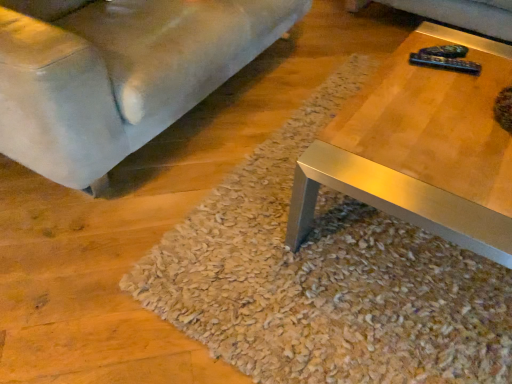
Question: Is shaggy beige carpet at center surrounded by suede-like gray couch at lower left?

Choices:
 (A) no
 (B) yes

Answer: (A)

Question: Is suede-like gray couch at lower left shorter than shaggy beige carpet at center?

Choices:
 (A) yes
 (B) no

Answer: (B)

Question: Considering the relative sizes of suede-like gray couch at lower left and shaggy beige carpet at center in the image provided, is suede-like gray couch at lower left bigger than shaggy beige carpet at center?

Choices:
 (A) no
 (B) yes

Answer: (B)

Question: Is the position of suede-like gray couch at lower left less distant than that of shaggy beige carpet at center?

Choices:
 (A) yes
 (B) no

Answer: (A)

Question: Is suede-like gray couch at lower left at the left side of shaggy beige carpet at center?

Choices:
 (A) no
 (B) yes

Answer: (B)

Question: Does suede-like gray couch at lower left appear on the right side of shaggy beige carpet at center?

Choices:
 (A) yes
 (B) no

Answer: (B)

Question: Considering the relative sizes of shaggy beige carpet at center and suede-like gray couch at lower left in the image provided, is shaggy beige carpet at center wider than suede-like gray couch at lower left?

Choices:
 (A) yes
 (B) no

Answer: (A)

Question: Is shaggy beige carpet at center beside suede-like gray couch at lower left?

Choices:
 (A) no
 (B) yes

Answer: (A)

Question: Considering the relative positions of shaggy beige carpet at center and suede-like gray couch at lower left in the image provided, is shaggy beige carpet at center behind suede-like gray couch at lower left?

Choices:
 (A) no
 (B) yes

Answer: (B)

Question: From a real-world perspective, is shaggy beige carpet at center under suede-like gray couch at lower left?

Choices:
 (A) yes
 (B) no

Answer: (A)

Question: Can you confirm if shaggy beige carpet at center is bigger than suede-like gray couch at lower left?

Choices:
 (A) yes
 (B) no

Answer: (B)

Question: Is shaggy beige carpet at center located outside suede-like gray couch at lower left?

Choices:
 (A) yes
 (B) no

Answer: (A)

Question: Considering the positions of shaggy beige carpet at center and suede-like gray couch at lower left in the image, is shaggy beige carpet at center wider or thinner than suede-like gray couch at lower left?

Choices:
 (A) thin
 (B) wide

Answer: (B)